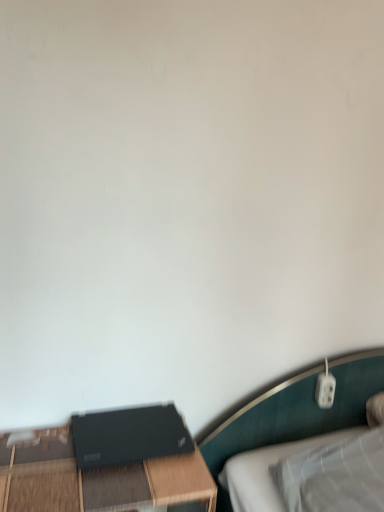
This screenshot has width=384, height=512. What are the coordinates of `vacant space situated on the left part of black matte laptop at lower left` in the screenshot? It's located at (34, 446).